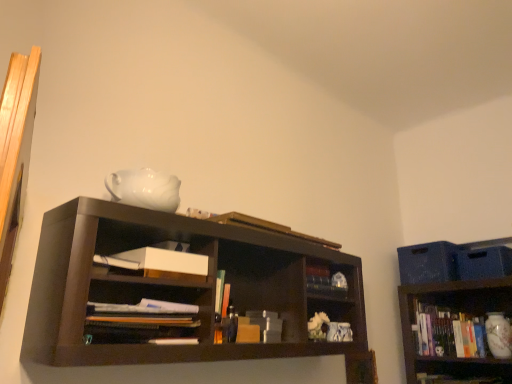
Question: From a real-world perspective, is gold metallic book at upper center, the second book in the left-to-right sequence, beneath white paper at center, acting as the 1th book starting from the left?

Choices:
 (A) yes
 (B) no

Answer: (B)

Question: Could you tell me if gold metallic book at upper center, the second book in the left-to-right sequence, is facing white paper at center, positioned as the 2th book in bottom-to-top order?

Choices:
 (A) no
 (B) yes

Answer: (A)

Question: Considering the relative sizes of gold metallic book at upper center, the second book in the left-to-right sequence, and white paper at center, positioned as the 2th book in bottom-to-top order, in the image provided, is gold metallic book at upper center, the second book in the left-to-right sequence, bigger than white paper at center, positioned as the 2th book in bottom-to-top order,?

Choices:
 (A) yes
 (B) no

Answer: (B)

Question: Considering the relative sizes of gold metallic book at upper center, the second book in the left-to-right sequence, and white paper at center, arranged as the second book when viewed from the top, in the image provided, is gold metallic book at upper center, the second book in the left-to-right sequence, wider than white paper at center, arranged as the second book when viewed from the top,?

Choices:
 (A) no
 (B) yes

Answer: (A)

Question: Is the surface of gold metallic book at upper center, acting as the 1th book starting from the top, in direct contact with white paper at center, arranged as the second book when viewed from the top?

Choices:
 (A) yes
 (B) no

Answer: (B)

Question: Is gold metallic book at upper center, the second book in the left-to-right sequence, far from white paper at center, arranged as the second book when viewed from the top?

Choices:
 (A) no
 (B) yes

Answer: (A)

Question: Considering the relative sizes of matte white vase at lower right and white matte paper at center in the image provided, is matte white vase at lower right thinner than white matte paper at center?

Choices:
 (A) no
 (B) yes

Answer: (A)

Question: Is matte white vase at lower right aimed at white matte paper at center?

Choices:
 (A) yes
 (B) no

Answer: (A)

Question: Can you confirm if matte white vase at lower right is taller than white matte paper at center?

Choices:
 (A) yes
 (B) no

Answer: (A)

Question: Is matte white vase at lower right turned away from white matte paper at center?

Choices:
 (A) no
 (B) yes

Answer: (A)

Question: Is the depth of matte white vase at lower right less than that of white matte paper at center?

Choices:
 (A) yes
 (B) no

Answer: (B)

Question: Is matte white vase at lower right placed right next to white matte paper at center?

Choices:
 (A) no
 (B) yes

Answer: (A)

Question: Considering the relative sizes of white matte paper at center and white paper at center, which is the third book from back to front, in the image provided, is white matte paper at center taller than white paper at center, which is the third book from back to front,?

Choices:
 (A) no
 (B) yes

Answer: (A)